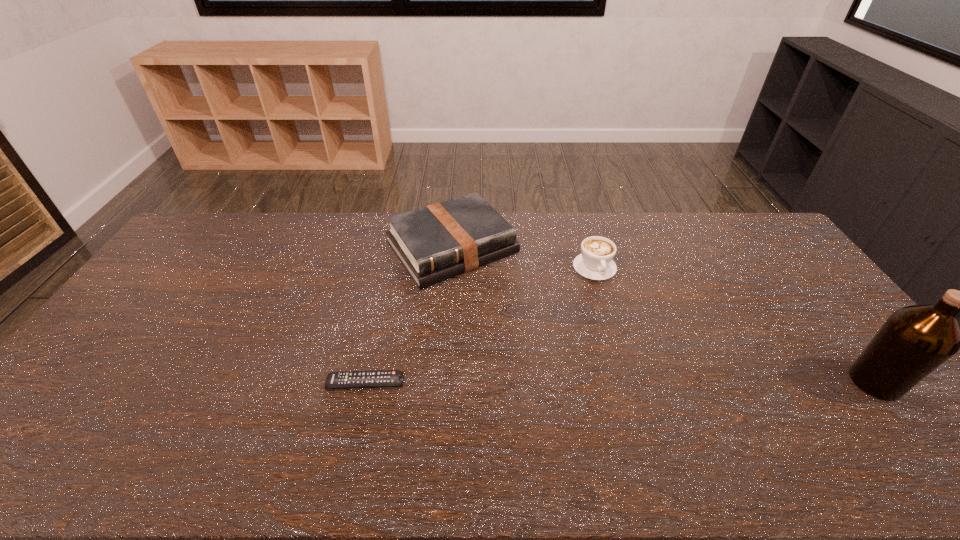
What are the coordinates of `free space at the far left corner of the desktop` in the screenshot? It's located at (187, 239).

In the image, there is a desktop. At what (x,y) coordinates should I click in order to perform the action: click on vacant region at the far right corner. Please return your answer as a coordinate pair (x, y). Looking at the image, I should click on (775, 242).

The width and height of the screenshot is (960, 540). What are the coordinates of `vacant space in between the hardback book and the shortest object` in the screenshot? It's located at (408, 315).

I want to click on vacant area that lies between the third object from left to right and the tallest object, so click(734, 325).

You are a GUI agent. You are given a task and a screenshot of the screen. Output one action in this format:
    pyautogui.click(x=<x>, y=<y>)
    Task: Click on the unoccupied area between the shortest object and the cappuccino
    The height and width of the screenshot is (540, 960).
    Given the screenshot: What is the action you would take?
    click(x=480, y=325)

Find the location of a particular element. The image size is (960, 540). vacant space that's between the second object from right to left and the remote control is located at coordinates (480, 325).

Where is `vacant area that lies between the rightmost object and the shortest object`? The width and height of the screenshot is (960, 540). vacant area that lies between the rightmost object and the shortest object is located at coordinates (620, 382).

Identify the location of free space between the cappuccino and the hardback book. (523, 258).

At what (x,y) coordinates should I click in order to perform the action: click on vacant area that lies between the tallest object and the hardback book. Please return your answer as a coordinate pair (x, y). Looking at the image, I should click on (663, 315).

Identify the location of free space between the olive oil and the third object from left to right. (734, 325).